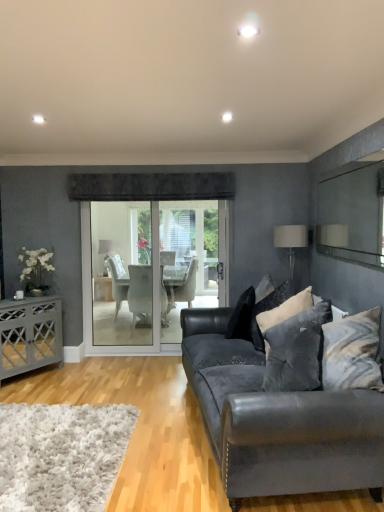
Measure the distance between velvet gray pillow at center, which ranks as the second pillow in front-to-back order, and camera.

velvet gray pillow at center, which ranks as the second pillow in front-to-back order, and camera are 3.09 meters apart from each other.

This screenshot has height=512, width=384. Identify the location of velvet gray pillow at center, arranged as the 3th pillow when viewed from the back. (285, 310).

Describe the element at coordinates (353, 214) in the screenshot. I see `clear glass mirror at upper right` at that location.

Describe the element at coordinates (291, 244) in the screenshot. This screenshot has height=512, width=384. I see `white fabric lampshade at upper right, the 1th lamp from the front` at that location.

Find the location of a particular element. The image size is (384, 512). black velvet pillow at center, acting as the 1th pillow starting from the back is located at coordinates (242, 316).

Describe the element at coordinates (35, 269) in the screenshot. The width and height of the screenshot is (384, 512). I see `white silk flower at left` at that location.

Where is `velvet black pillow at center, which is the third pillow from front to back`? This screenshot has height=512, width=384. velvet black pillow at center, which is the third pillow from front to back is located at coordinates (267, 310).

Does clear glass mirror at upper right have a lesser width compared to velvet gray pillow at center, arranged as the 3th pillow when viewed from the back?

Correct, the width of clear glass mirror at upper right is less than that of velvet gray pillow at center, arranged as the 3th pillow when viewed from the back.

From the picture: Is clear glass mirror at upper right bigger or smaller than velvet gray pillow at center, arranged as the 3th pillow when viewed from the back?

Considering their sizes, clear glass mirror at upper right takes up less space than velvet gray pillow at center, arranged as the 3th pillow when viewed from the back.

Does clear glass mirror at upper right turn towards velvet gray pillow at center, which ranks as the second pillow in front-to-back order?

No, clear glass mirror at upper right is not turned towards velvet gray pillow at center, which ranks as the second pillow in front-to-back order.

Considering the relative positions of clear glass mirror at upper right and velvet gray pillow at center, which ranks as the second pillow in front-to-back order, in the image provided, is clear glass mirror at upper right to the left of velvet gray pillow at center, which ranks as the second pillow in front-to-back order, from the viewer's perspective?

No, clear glass mirror at upper right is not to the left of velvet gray pillow at center, which ranks as the second pillow in front-to-back order.

How much distance is there between black velvet pillow at center, which ranks as the 4th pillow in front-to-back order, and white silk flower at left?

black velvet pillow at center, which ranks as the 4th pillow in front-to-back order, is 2.20 meters away from white silk flower at left.

Can you tell me how much black velvet pillow at center, acting as the 1th pillow starting from the back, and white silk flower at left differ in facing direction?

The angular difference between black velvet pillow at center, acting as the 1th pillow starting from the back, and white silk flower at left is 135 degrees.

Is the surface of black velvet pillow at center, which ranks as the 4th pillow in front-to-back order, in direct contact with white silk flower at left?

No, black velvet pillow at center, which ranks as the 4th pillow in front-to-back order, is not in contact with white silk flower at left.

Identify the location of flower above the black velvet pillow at center, which ranks as the 4th pillow in front-to-back order (from a real-world perspective). (35, 269).

Is dark gray textured pillow at center right, the 1th pillow positioned from the front, directly adjacent to black velvet pillow at center, acting as the 1th pillow starting from the back?

No, dark gray textured pillow at center right, the 1th pillow positioned from the front, is not touching black velvet pillow at center, acting as the 1th pillow starting from the back.

Considering the positions of objects dark gray textured pillow at center right, the fourth pillow when ordered from back to front, and black velvet pillow at center, acting as the 1th pillow starting from the back, in the image provided, who is behind, dark gray textured pillow at center right, the fourth pillow when ordered from back to front, or black velvet pillow at center, acting as the 1th pillow starting from the back,?

Positioned behind is black velvet pillow at center, acting as the 1th pillow starting from the back.

From a real-world perspective, starting from the dark gray textured pillow at center right, the fourth pillow when ordered from back to front, which pillow is the 1st one vertically above it? Please provide its 2D coordinates.

[(242, 316)]

Which is more to the right, dark gray textured pillow at center right, the 1th pillow positioned from the front, or black velvet pillow at center, which ranks as the 4th pillow in front-to-back order?

dark gray textured pillow at center right, the 1th pillow positioned from the front.

Does black velvet pillow at center, acting as the 1th pillow starting from the back, have a smaller size compared to white fabric lampshade at upper right, arranged as the 2th lamp when viewed from the back?

Actually, black velvet pillow at center, acting as the 1th pillow starting from the back, might be larger than white fabric lampshade at upper right, arranged as the 2th lamp when viewed from the back.

From the image's perspective, is black velvet pillow at center, which ranks as the 4th pillow in front-to-back order, located above or below white fabric lampshade at upper right, arranged as the 2th lamp when viewed from the back?

From the image's perspective, black velvet pillow at center, which ranks as the 4th pillow in front-to-back order, appears below white fabric lampshade at upper right, arranged as the 2th lamp when viewed from the back.

From a real-world perspective, which object rests below the other?

In real-world perspective, black velvet pillow at center, acting as the 1th pillow starting from the back, is lower.

Is velvet black couch at lower right not inside clear glass mirror at upper right?

velvet black couch at lower right is positioned outside clear glass mirror at upper right.

Is velvet black couch at lower right touching clear glass mirror at upper right?

No, velvet black couch at lower right is not beside clear glass mirror at upper right.

From a real-world perspective, is velvet black couch at lower right above or below clear glass mirror at upper right?

In terms of real-world spatial position, velvet black couch at lower right is below clear glass mirror at upper right.

Looking at their sizes, would you say velvet black couch at lower right is wider or thinner than clear glass mirror at upper right?

Considering their sizes, velvet black couch at lower right looks broader than clear glass mirror at upper right.

Considering the relative sizes of velvet black pillow at center, the 2th pillow viewed from the back, and clear glass mirror at upper right in the image provided, is velvet black pillow at center, the 2th pillow viewed from the back, thinner than clear glass mirror at upper right?

Incorrect, the width of velvet black pillow at center, the 2th pillow viewed from the back, is not less than that of clear glass mirror at upper right.

Which object is further away from the camera taking this photo, velvet black pillow at center, the 2th pillow viewed from the back, or clear glass mirror at upper right?

velvet black pillow at center, the 2th pillow viewed from the back, is further from the camera.

Is black velvet pillow at center, acting as the 1th pillow starting from the back, turned away from velvet black couch at lower right?

That's right, black velvet pillow at center, acting as the 1th pillow starting from the back, is facing away from velvet black couch at lower right.

Based on the photo, is black velvet pillow at center, which ranks as the 4th pillow in front-to-back order, at the right side of velvet black couch at lower right?

No, black velvet pillow at center, which ranks as the 4th pillow in front-to-back order, is not to the right of velvet black couch at lower right.

Does black velvet pillow at center, which ranks as the 4th pillow in front-to-back order, have a greater width compared to velvet black couch at lower right?

In fact, black velvet pillow at center, which ranks as the 4th pillow in front-to-back order, might be narrower than velvet black couch at lower right.

Is the depth of black velvet pillow at center, which ranks as the 4th pillow in front-to-back order, greater than that of velvet black couch at lower right?

Yes, the depth of black velvet pillow at center, which ranks as the 4th pillow in front-to-back order, is greater than that of velvet black couch at lower right.

Image resolution: width=384 pixels, height=512 pixels. In order to click on pillow that is the 2nd one when counting leftward from the clear glass mirror at upper right in this screenshot , I will do `click(285, 310)`.

This screenshot has width=384, height=512. Identify the location of flower that is behind the black velvet pillow at center, acting as the 1th pillow starting from the back. (35, 269).

Considering their positions, is clear glass mirror at upper right positioned closer to white silk flower at left than matte gray cabinet at left?

matte gray cabinet at left.

Based on the photo, based on their spatial positions, is white fabric lampshade at upper right, arranged as the 2th lamp when viewed from the back, or white silk flower at left further from velvet black couch at lower right?

white silk flower at left is positioned further to the anchor velvet black couch at lower right.

Consider the image. Estimate the real-world distances between objects in this image. Which object is closer to black velvet pillow at center, which ranks as the 4th pillow in front-to-back order, white silk flower at left or white fabric lampshade at upper right, the 1th lamp from the front?

white fabric lampshade at upper right, the 1th lamp from the front, is positioned closer to the anchor black velvet pillow at center, which ranks as the 4th pillow in front-to-back order.

When comparing their distances from white silk flower at left, does clear glass mirror at upper right or dark gray textured pillow at center right, the 1th pillow positioned from the front, seem closer?

dark gray textured pillow at center right, the 1th pillow positioned from the front.

Based on their spatial positions, is white fabric lampshade at upper right, arranged as the 2th lamp when viewed from the back, or clear glass mirror at upper right further from matte gray cabinet at left?

clear glass mirror at upper right is positioned further to the anchor matte gray cabinet at left.

When comparing their distances from black velvet pillow at center, acting as the 1th pillow starting from the back, does matte gray cabinet at left or velvet gray pillow at center, arranged as the 3th pillow when viewed from the back, seem closer?

The object closer to black velvet pillow at center, acting as the 1th pillow starting from the back, is velvet gray pillow at center, arranged as the 3th pillow when viewed from the back.

Looking at the image, which one is located closer to black velvet pillow at center, acting as the 1th pillow starting from the back, clear glass mirror at upper right or velvet gray pillow at center, which ranks as the second pillow in front-to-back order?

Among the two, velvet gray pillow at center, which ranks as the second pillow in front-to-back order, is located nearer to black velvet pillow at center, acting as the 1th pillow starting from the back.

From the picture: Based on their spatial positions, is velvet black couch at lower right or velvet gray pillow at center, arranged as the 3th pillow when viewed from the back, closer to matte gray cabinet at left?

velvet gray pillow at center, arranged as the 3th pillow when viewed from the back.

The image size is (384, 512). Identify the location of studio couch located between white silk flower at left and clear glass mirror at upper right in the left-right direction. (277, 421).

Where is `flower located between matte gray cabinet at left and velvet gray pillow at center, arranged as the 3th pillow when viewed from the back, in the left-right direction`? The width and height of the screenshot is (384, 512). flower located between matte gray cabinet at left and velvet gray pillow at center, arranged as the 3th pillow when viewed from the back, in the left-right direction is located at coordinates (35, 269).

At what (x,y) coordinates should I click in order to perform the action: click on flower between clear glass mirror at upper right and white fabric lampshade at center, acting as the second lamp starting from the right, from front to back. Please return your answer as a coordinate pair (x, y). Looking at the image, I should click on (35, 269).

You are a GUI agent. You are given a task and a screenshot of the screen. Output one action in this format:
    pyautogui.click(x=<x>, y=<y>)
    Task: Click on the studio couch between matte gray cabinet at left and white fabric lampshade at upper right, the 1th lamp from the front, in the horizontal direction
    The height and width of the screenshot is (512, 384).
    Given the screenshot: What is the action you would take?
    pyautogui.click(x=277, y=421)